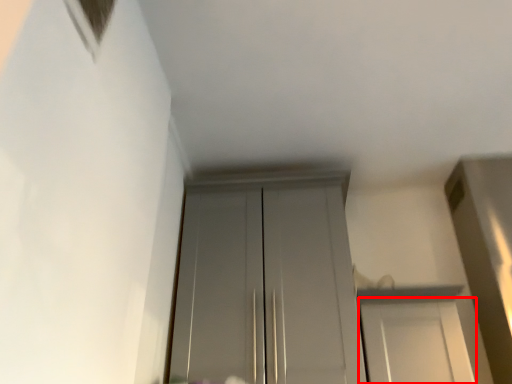
Question: From the image's perspective, where is door (annotated by the red box) located in relation to door in the image?

Choices:
 (A) below
 (B) above

Answer: (A)